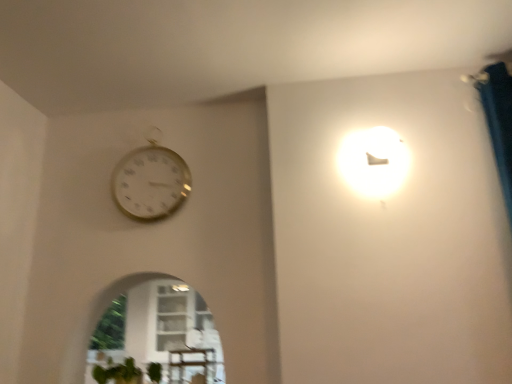
Describe the element at coordinates (150, 182) in the screenshot. I see `gold metallic wall clock at upper left` at that location.

Locate an element on the screen. gold metallic wall clock at upper left is located at coordinates (150, 182).

Considering the relative positions of gold metallic wall clock at upper left and wooden table at lower center in the image provided, is gold metallic wall clock at upper left to the left or to the right of wooden table at lower center?

Based on their positions, gold metallic wall clock at upper left is located to the left of wooden table at lower center.

Based on their sizes in the image, would you say gold metallic wall clock at upper left is bigger or smaller than wooden table at lower center?

Clearly, gold metallic wall clock at upper left is larger in size than wooden table at lower center.

Would you say gold metallic wall clock at upper left is a long distance from wooden table at lower center?

That's not correct — gold metallic wall clock at upper left is a little close to wooden table at lower center.

From a real-world perspective, is gold metallic wall clock at upper left above or below wooden table at lower center?

In terms of real-world spatial position, gold metallic wall clock at upper left is above wooden table at lower center.

Which is in front, gold metallic wall clock at upper left or green matte plant at lower left?

green matte plant at lower left is closer to the camera.

Is gold metallic wall clock at upper left facing away from green matte plant at lower left?

gold metallic wall clock at upper left is not turned away from green matte plant at lower left.

Based on the photo, from a real-world perspective, is gold metallic wall clock at upper left on green matte plant at lower left?

Indeed, from a real-world perspective, gold metallic wall clock at upper left stands above green matte plant at lower left.

At what (x,y) coordinates should I click in order to perform the action: click on wall clock on the right of green matte plant at lower left. Please return your answer as a coordinate pair (x, y). Looking at the image, I should click on (150, 182).

Could you tell me if green matte plant at lower left is turned towards gold metallic wall clock at upper left?

No.

Can you confirm if green matte plant at lower left is taller than gold metallic wall clock at upper left?

In fact, green matte plant at lower left may be shorter than gold metallic wall clock at upper left.

Considering the relative positions of green matte plant at lower left and gold metallic wall clock at upper left in the image provided, is green matte plant at lower left in front of gold metallic wall clock at upper left?

Yes, the depth of green matte plant at lower left is less than that of gold metallic wall clock at upper left.

Is wooden table at lower center shorter than gold metallic wall clock at upper left?

Yes, wooden table at lower center is shorter than gold metallic wall clock at upper left.

Which point is more distant from viewer, (199, 363) or (189, 192)?

The point (189, 192) is farther from the camera.

Is wooden table at lower center next to gold metallic wall clock at upper left?

No, wooden table at lower center is not touching gold metallic wall clock at upper left.

Is wooden table at lower center far away from green matte plant at lower left?

No, there isn't a large distance between wooden table at lower center and green matte plant at lower left.

From the image's perspective, is wooden table at lower center positioned above or below green matte plant at lower left?

wooden table at lower center is above green matte plant at lower left.

Which of these two, wooden table at lower center or green matte plant at lower left, is bigger?

Bigger between the two is green matte plant at lower left.

In terms of width, does wooden table at lower center look wider or thinner when compared to green matte plant at lower left?

Considering their sizes, wooden table at lower center looks slimmer than green matte plant at lower left.

Is green matte plant at lower left oriented away from wooden table at lower center?

No.

In the scene shown: Looking at their sizes, would you say green matte plant at lower left is wider or thinner than wooden table at lower center?

Considering their sizes, green matte plant at lower left looks broader than wooden table at lower center.

From a real-world perspective, is green matte plant at lower left physically located above or below wooden table at lower center?

green matte plant at lower left is situated lower than wooden table at lower center in the real world.

You are a GUI agent. You are given a task and a screenshot of the screen. Output one action in this format:
    pyautogui.click(x=<x>, y=<y>)
    Task: Click on the wall clock to the left of wooden table at lower center
    This screenshot has width=512, height=384.
    Given the screenshot: What is the action you would take?
    pyautogui.click(x=150, y=182)

Where is `plant below the gold metallic wall clock at upper left (from a real-world perspective)`? This screenshot has width=512, height=384. plant below the gold metallic wall clock at upper left (from a real-world perspective) is located at coordinates (118, 372).

Looking at the image, which one is located closer to gold metallic wall clock at upper left, wooden table at lower center or green matte plant at lower left?

wooden table at lower center.

Based on their spatial positions, is green matte plant at lower left or wooden table at lower center closer to gold metallic wall clock at upper left?

wooden table at lower center is positioned closer to the anchor gold metallic wall clock at upper left.

Looking at the image, which one is located closer to green matte plant at lower left, gold metallic wall clock at upper left or wooden table at lower center?

wooden table at lower center is positioned closer to the anchor green matte plant at lower left.

Considering their positions, is gold metallic wall clock at upper left positioned closer to wooden table at lower center than green matte plant at lower left?

green matte plant at lower left is closer to wooden table at lower center.

Estimate the real-world distances between objects in this image. Which object is closer to wooden table at lower center, green matte plant at lower left or gold metallic wall clock at upper left?

Among the two, green matte plant at lower left is located nearer to wooden table at lower center.

Based on their spatial positions, is wooden table at lower center or gold metallic wall clock at upper left further from green matte plant at lower left?

gold metallic wall clock at upper left.

This screenshot has width=512, height=384. What are the coordinates of `table that lies between gold metallic wall clock at upper left and green matte plant at lower left from top to bottom` in the screenshot? It's located at (191, 365).